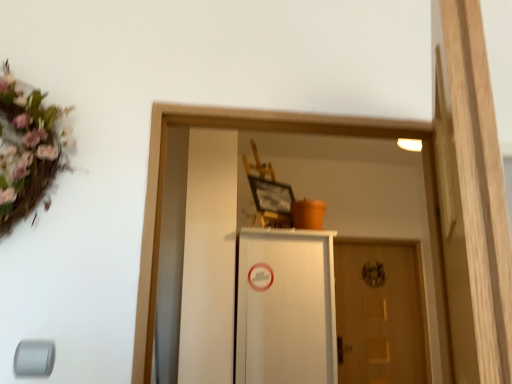
Where is `empty space that is ontop of wooden door at center (from a real-world perspective)`? Image resolution: width=512 pixels, height=384 pixels. empty space that is ontop of wooden door at center (from a real-world perspective) is located at coordinates (373, 243).